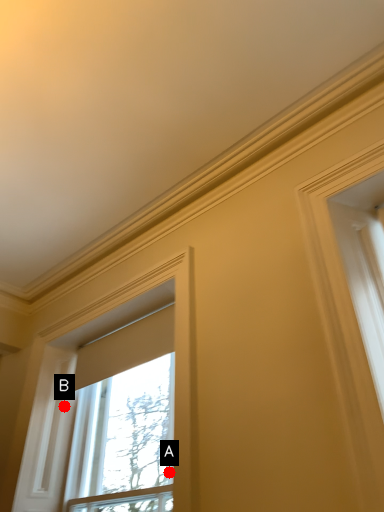
Question: Two points are circled on the image, labeled by A and B beside each circle. Which point appears farthest from the camera in this image?

Choices:
 (A) A is further
 (B) B is further

Answer: (B)